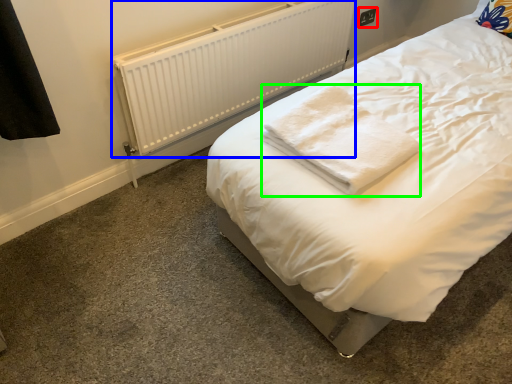
Question: Which object is the farthest from electric outlet (highlighted by a red box)? Choose among these: radiator (highlighted by a blue box) or cloth (highlighted by a green box).

Choices:
 (A) radiator
 (B) cloth

Answer: (B)